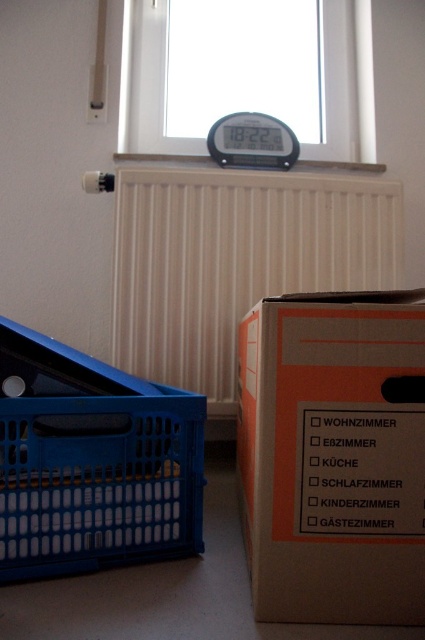
Is point (229, 365) positioned after point (121, 150)?

No, it is not.

Looking at this image, between white matte radiator at center and transparent glass window at upper center, which one is positioned higher?

Positioned higher is transparent glass window at upper center.

Between point (133, 241) and point (370, 1), which one is positioned in front?

Positioned in front is point (133, 241).

Locate an element on the screen. This screenshot has width=425, height=640. white matte radiator at center is located at coordinates (235, 260).

Which is behind, point (144, 237) or point (252, 131)?

The point (252, 131) is behind.

Can you confirm if white matte radiator at center is positioned to the right of black plastic alarm clock at upper center?

Indeed, white matte radiator at center is positioned on the right side of black plastic alarm clock at upper center.

What are the coordinates of `white matte radiator at center` in the screenshot? It's located at (235, 260).

You are a GUI agent. You are given a task and a screenshot of the screen. Output one action in this format:
    pyautogui.click(x=<x>, y=<y>)
    Task: Click on the white matte radiator at center
    
    Given the screenshot: What is the action you would take?
    pyautogui.click(x=235, y=260)

Consider the image. Between blue plastic laundry basket at lower left and transparent glass window at upper center, which one has more height?

With more height is transparent glass window at upper center.

From the picture: Who is shorter, blue plastic laundry basket at lower left or transparent glass window at upper center?

Standing shorter between the two is blue plastic laundry basket at lower left.

Who is more forward, (39, 509) or (149, 106)?

Point (39, 509)

Where is `blue plastic laundry basket at lower left`? The height and width of the screenshot is (640, 425). blue plastic laundry basket at lower left is located at coordinates (91, 461).